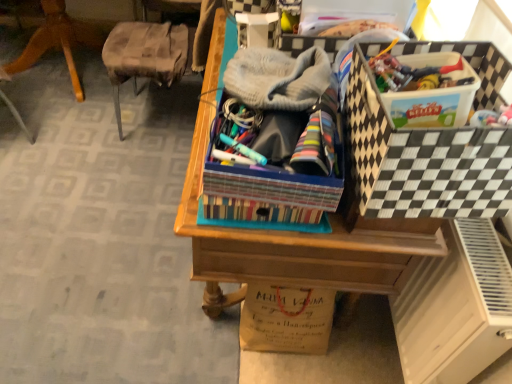
The width and height of the screenshot is (512, 384). Identify the location of space that is in front of brown paper bag at lower center. (273, 365).